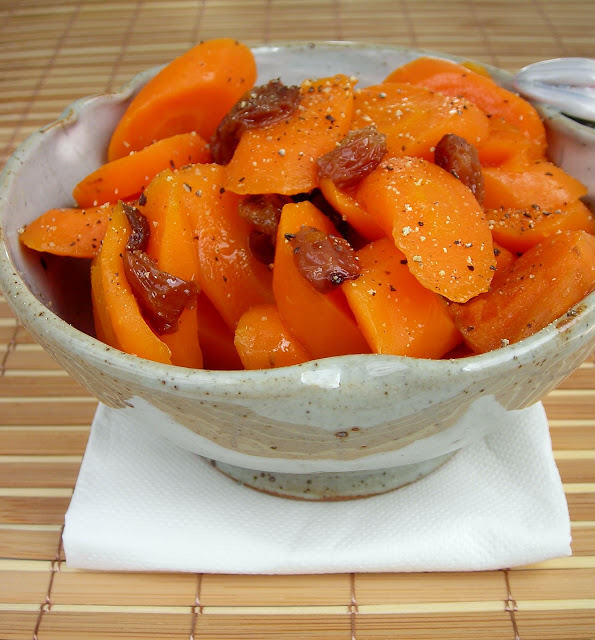
Find the location of a particular element. crease in napkin is located at coordinates (487, 445), (475, 470), (352, 548), (296, 539), (111, 434).